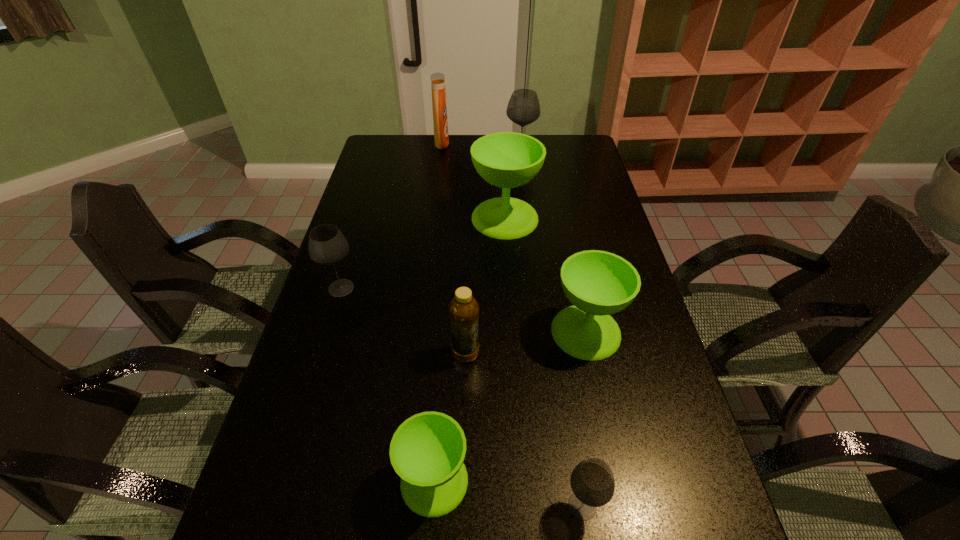
I want to click on free space between the third nearest wineglass and the farthest wineglass, so click(553, 244).

You are a GUI agent. You are given a task and a screenshot of the screen. Output one action in this format:
    pyautogui.click(x=<x>, y=<y>)
    Task: Click on the free spot between the smallest gray wineglass and the detergent
    The image size is (960, 540).
    Given the screenshot: What is the action you would take?
    pyautogui.click(x=513, y=325)

Find the location of a particular element. Image resolution: width=960 pixels, height=540 pixels. free spot between the farthest wineglass and the bottle is located at coordinates (492, 255).

Locate an element on the screen. This screenshot has height=540, width=960. vacant space that's between the second farthest gray wineglass and the biggest gray wineglass is located at coordinates (431, 222).

Find the location of `free space between the smallest green wineglass and the detergent`. free space between the smallest green wineglass and the detergent is located at coordinates 438,312.

Find the location of a particular element. object that is the second closest to the nearest gray wineglass is located at coordinates (598, 283).

I want to click on object that is the fourth closest to the detergent, so click(598, 283).

Choose which wineglass is the third nearest neighbor to the second farthest green wineglass. Please provide its 2D coordinates. Your answer should be formatted as a tuple, i.e. [(x, y)], where the tuple contains the x and y coordinates of a point satisfying the conditions above.

[(427, 451)]

The image size is (960, 540). I want to click on wineglass that can be found as the third closest to the farthest gray wineglass, so click(327, 245).

You are a GUI agent. You are given a task and a screenshot of the screen. Output one action in this format:
    pyautogui.click(x=<x>, y=<y>)
    Task: Click on the second closest gray wineglass to the second smallest gray wineglass
    The image size is (960, 540).
    Given the screenshot: What is the action you would take?
    pyautogui.click(x=523, y=108)